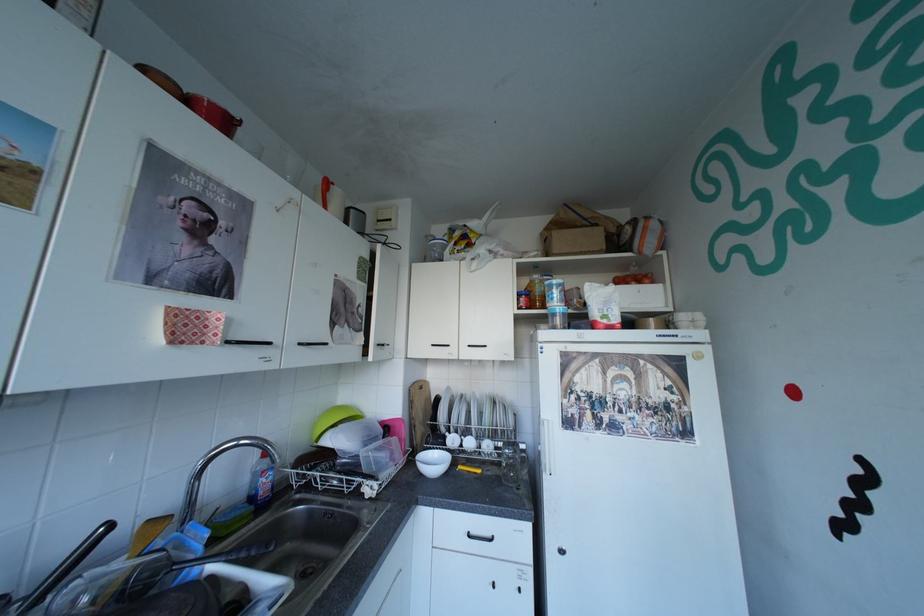
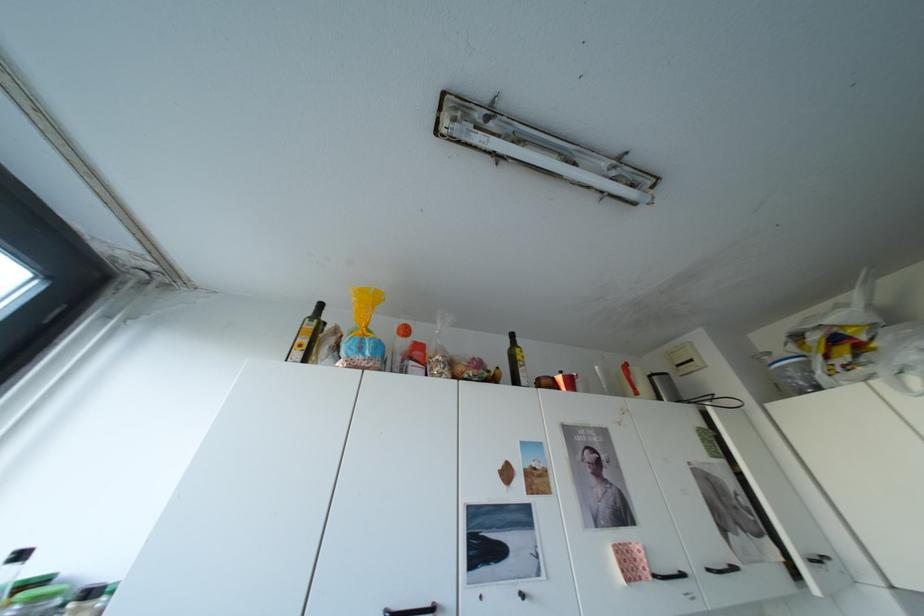
The first image is from the beginning of the video and the second image is from the end. How did the camera likely rotate when shooting the video?

The camera's rotation is toward left-up.